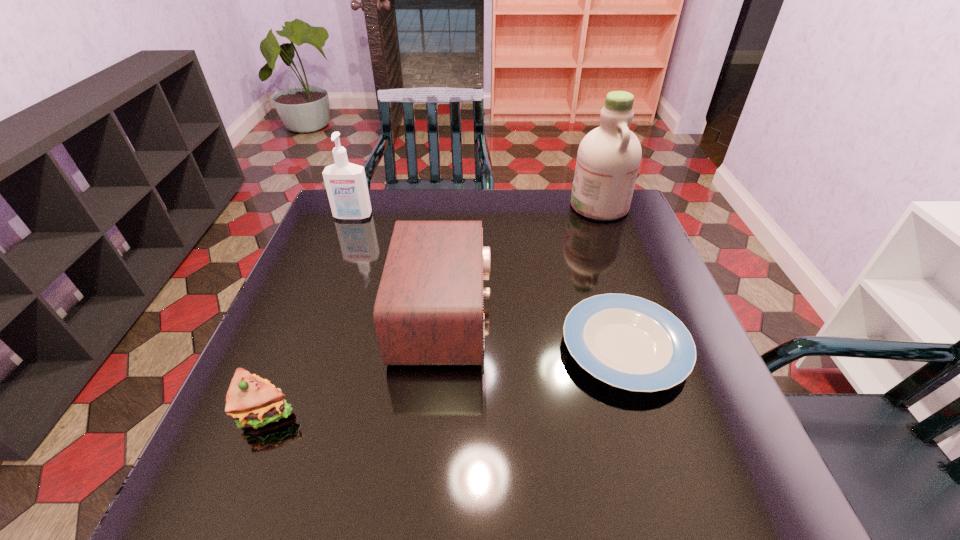
Find the location of a particular element. the taller cleansing agent is located at coordinates (608, 159).

Where is `the tallest object`? This screenshot has width=960, height=540. the tallest object is located at coordinates (608, 159).

You are a GUI agent. You are given a task and a screenshot of the screen. Output one action in this format:
    pyautogui.click(x=<x>, y=<y>)
    Task: Click on the shorter cleansing agent
    
    Given the screenshot: What is the action you would take?
    pyautogui.click(x=346, y=185)

This screenshot has height=540, width=960. Find the location of `the left cleansing agent`. the left cleansing agent is located at coordinates (x=346, y=185).

What are the coordinates of `the third object from left to right` in the screenshot? It's located at (428, 310).

Locate an element on the screen. radio receiver is located at coordinates (428, 310).

What are the coordinates of `sandwich` in the screenshot? It's located at (251, 401).

The width and height of the screenshot is (960, 540). I want to click on plate, so click(626, 341).

At what (x,y) coordinates should I click in order to perform the action: click on vacant region located 0.110m on the front label of the taller cleansing agent. Please return your answer as a coordinate pair (x, y). Looking at the image, I should click on (537, 206).

You are a GUI agent. You are given a task and a screenshot of the screen. Output one action in this format:
    pyautogui.click(x=<x>, y=<y>)
    Task: Click on the free location located 0.190m on the front label of the taller cleansing agent
    This screenshot has height=540, width=960.
    Given the screenshot: What is the action you would take?
    pyautogui.click(x=512, y=206)